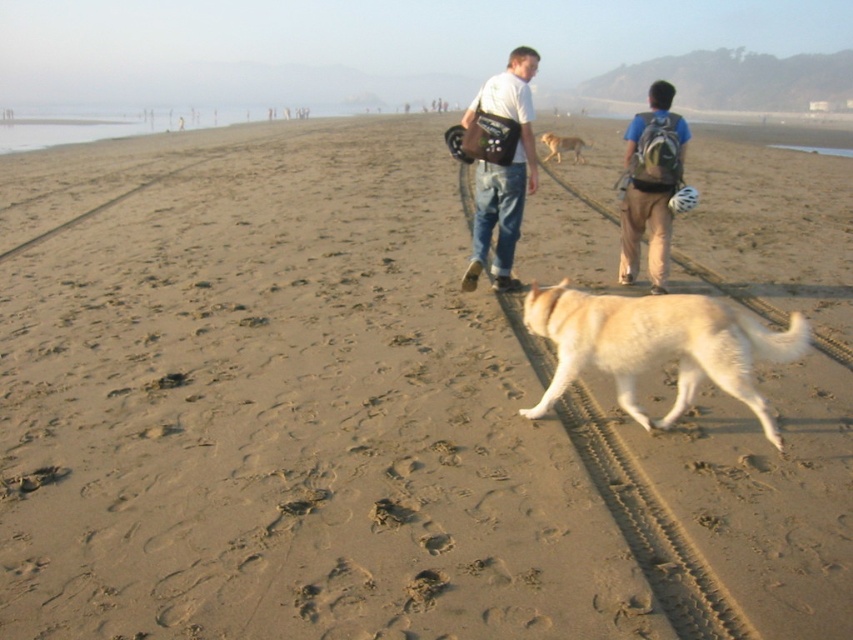
Question: Which object is the closest to the golden fur dog at center?

Choices:
 (A) matte brown backpack at right
 (B) matte brown bag at center
 (C) white fluffy dog at center

Answer: (A)

Question: Which of the following is the farthest from the observer?

Choices:
 (A) (523, 113)
 (B) (633, 147)
 (C) (753, 328)

Answer: (B)

Question: Is matte brown bag at center behind golden fur dog at center?

Choices:
 (A) yes
 (B) no

Answer: (B)

Question: Among these points, which one is nearest to the camera?

Choices:
 (A) click(572, 148)
 (B) click(741, 340)

Answer: (B)

Question: Is the position of white fluffy dog at center more distant than that of matte brown bag at center?

Choices:
 (A) yes
 (B) no

Answer: (B)

Question: Where is white fluffy dog at center located in relation to matte brown backpack at right in the image?

Choices:
 (A) below
 (B) above

Answer: (A)